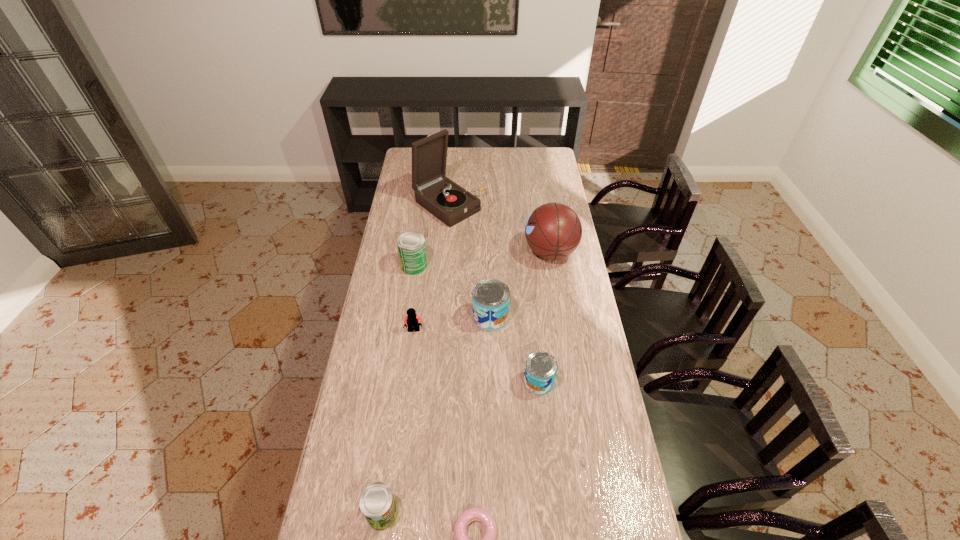
Identify the location of the farthest object. This screenshot has height=540, width=960. (450, 203).

You are a GUI agent. You are given a task and a screenshot of the screen. Output one action in this format:
    pyautogui.click(x=<x>, y=<y>)
    Task: Click on the phonograph record
    
    Given the screenshot: What is the action you would take?
    pyautogui.click(x=450, y=203)

Identify the location of basketball. (553, 231).

Find the location of a particular element. the bigger green can is located at coordinates (411, 245).

Locate an element on the screen. This screenshot has height=540, width=960. the farther green can is located at coordinates (411, 245).

I want to click on the bigger blue can, so pyautogui.click(x=490, y=297).

Locate an element on the screen. the farther blue can is located at coordinates (490, 297).

The height and width of the screenshot is (540, 960). I want to click on black Lego, so pyautogui.click(x=412, y=320).

In order to click on the sixth farthest object in this screenshot , I will do `click(540, 370)`.

What are the coordinates of `the smaller blue can` in the screenshot? It's located at [540, 370].